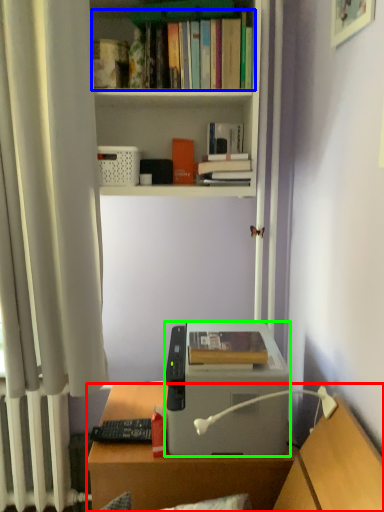
Question: Based on their relative distances, which object is farther from desk (highlighted by a red box)? Choose from book (highlighted by a blue box) and printer (highlighted by a green box).

Choices:
 (A) book
 (B) printer

Answer: (A)